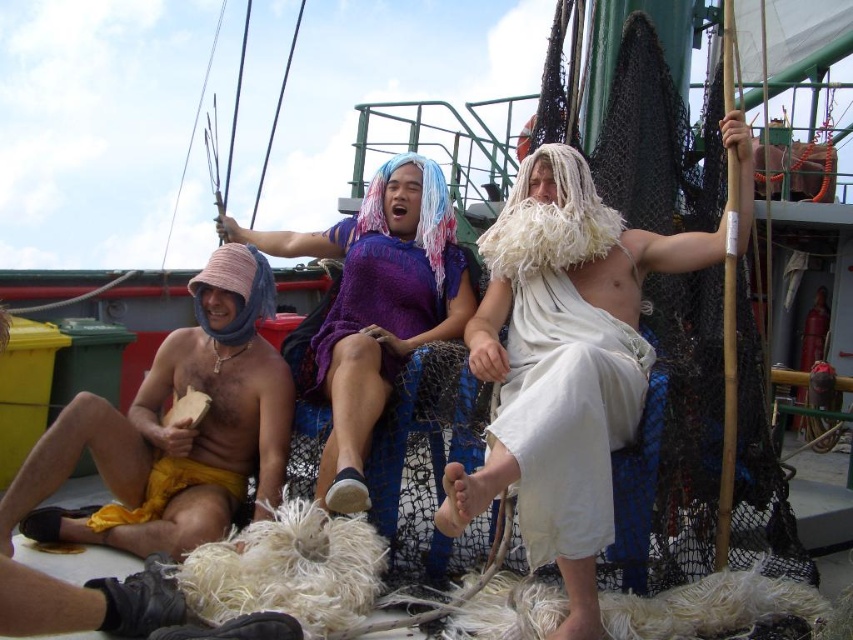
Question: Is matte yellow shorts at left bigger than purple knitted robe at center?

Choices:
 (A) no
 (B) yes

Answer: (B)

Question: Which object is the closest to the matte yellow shorts at left?

Choices:
 (A) white clothed man at center
 (B) purple knitted robe at center

Answer: (B)

Question: Which object is closer to the camera taking this photo?

Choices:
 (A) matte yellow shorts at left
 (B) purple knitted robe at center
 (C) white cloth at center
 (D) white clothed man at center

Answer: (D)

Question: In this image, where is white clothed man at center located relative to white cloth at center?

Choices:
 (A) below
 (B) above

Answer: (B)

Question: Does white clothed man at center have a lesser width compared to purple knitted robe at center?

Choices:
 (A) no
 (B) yes

Answer: (A)

Question: Among these objects, which one is farthest from the camera?

Choices:
 (A) purple knitted robe at center
 (B) white cloth at center
 (C) white clothed man at center

Answer: (A)